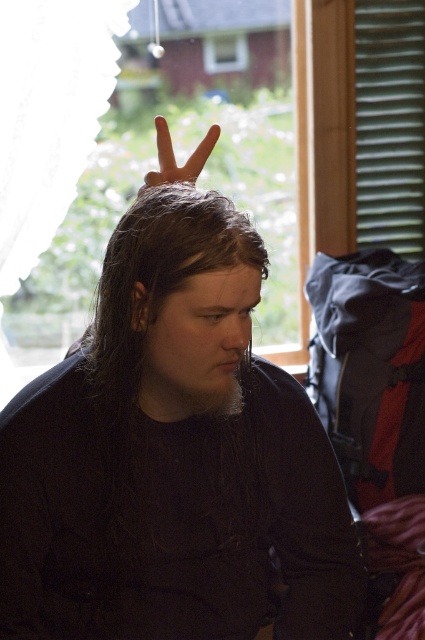
Question: Can you confirm if dark brown hair at center is positioned above matte skin hand at center?

Choices:
 (A) no
 (B) yes

Answer: (A)

Question: From the image, what is the correct spatial relationship of dark brown hair at center in relation to matte skin hand at center?

Choices:
 (A) below
 (B) above

Answer: (A)

Question: Does black matte shirt at center appear on the right side of matte skin hand at center?

Choices:
 (A) yes
 (B) no

Answer: (A)

Question: Which object is the closest to the black matte shirt at center?

Choices:
 (A) dark brown hair at center
 (B) matte skin hand at center

Answer: (A)

Question: Which of the following is the farthest from the observer?

Choices:
 (A) (124, 385)
 (B) (170, 163)
 (C) (201, 605)

Answer: (B)

Question: Which is farther from the black matte shirt at center?

Choices:
 (A) dark brown hair at center
 (B) matte skin hand at center

Answer: (B)